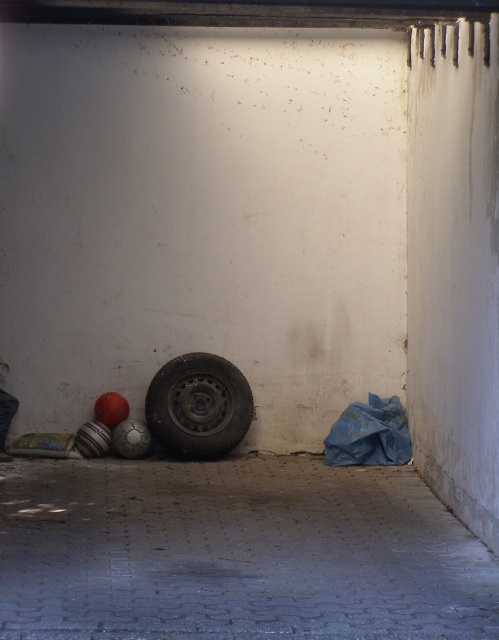
Measure the distance between smooth concrete floor at center and black rubber tire at lower left.

smooth concrete floor at center and black rubber tire at lower left are 4.14 meters apart from each other.

Does smooth concrete floor at center lie in front of black rubber tire at lower left?

That is True.

The image size is (499, 640). Describe the element at coordinates (236, 552) in the screenshot. I see `smooth concrete floor at center` at that location.

Where is `smooth concrete floor at center`? The height and width of the screenshot is (640, 499). smooth concrete floor at center is located at coordinates (236, 552).